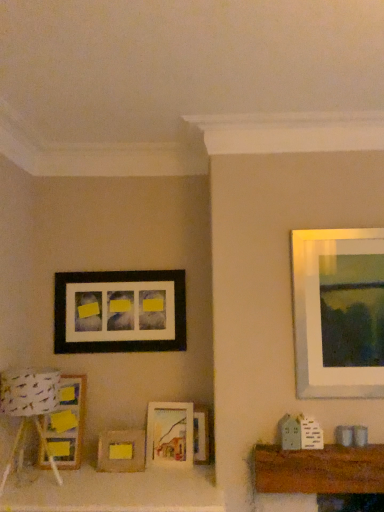
Question: Should I look upward or downward to see wooden picture frame at center, which ranks as the fourth picture frame in top-to-bottom order?

Choices:
 (A) down
 (B) up

Answer: (A)

Question: Can you confirm if matte wooden picture frame at center, which is the third picture frame in top-to-bottom order, is smaller than wooden picture frame at center, which is the 2th picture frame from bottom to top?

Choices:
 (A) no
 (B) yes

Answer: (A)

Question: Is matte wooden picture frame at center, which is the third picture frame in top-to-bottom order, aimed at wooden picture frame at center, which ranks as the fourth picture frame in top-to-bottom order?

Choices:
 (A) no
 (B) yes

Answer: (A)

Question: Is the position of matte wooden picture frame at center, which is the third picture frame in top-to-bottom order, more distant than that of wooden picture frame at center, which is the 2th picture frame from bottom to top?

Choices:
 (A) no
 (B) yes

Answer: (A)

Question: Does matte wooden picture frame at center, which is the third picture frame in top-to-bottom order, have a larger size compared to wooden picture frame at center, which ranks as the fourth picture frame in top-to-bottom order?

Choices:
 (A) yes
 (B) no

Answer: (A)

Question: From a real-world perspective, does matte wooden picture frame at center, which is the third picture frame in top-to-bottom order, stand above wooden picture frame at center, which ranks as the fourth picture frame in top-to-bottom order?

Choices:
 (A) no
 (B) yes

Answer: (B)

Question: Does matte wooden picture frame at center, which is the third picture frame in top-to-bottom order, appear on the left side of wooden picture frame at center, which ranks as the fourth picture frame in top-to-bottom order?

Choices:
 (A) yes
 (B) no

Answer: (A)

Question: Is matte wooden picture frame at center, the third picture frame positioned from the bottom, thinner than white paper lampshade at lower left?

Choices:
 (A) no
 (B) yes

Answer: (B)

Question: Is white paper lampshade at lower left at the back of matte wooden picture frame at center, the third picture frame positioned from the bottom?

Choices:
 (A) yes
 (B) no

Answer: (B)

Question: Does matte wooden picture frame at center, which is the third picture frame in top-to-bottom order, have a greater height compared to white paper lampshade at lower left?

Choices:
 (A) yes
 (B) no

Answer: (B)

Question: Does matte wooden picture frame at center, the third picture frame positioned from the bottom, touch white paper lampshade at lower left?

Choices:
 (A) yes
 (B) no

Answer: (B)

Question: Does matte wooden picture frame at center, which is the third picture frame in top-to-bottom order, turn towards white paper lampshade at lower left?

Choices:
 (A) no
 (B) yes

Answer: (A)

Question: Could white paper lampshade at lower left be considered to be inside matte wooden picture frame at center, the third picture frame positioned from the bottom?

Choices:
 (A) no
 (B) yes

Answer: (A)

Question: Does wooden picture frame at center, which ranks as the fourth picture frame in top-to-bottom order, have a smaller size compared to matte wooden picture frame at lower left, which ranks as the second picture frame in top-to-bottom order?

Choices:
 (A) yes
 (B) no

Answer: (A)